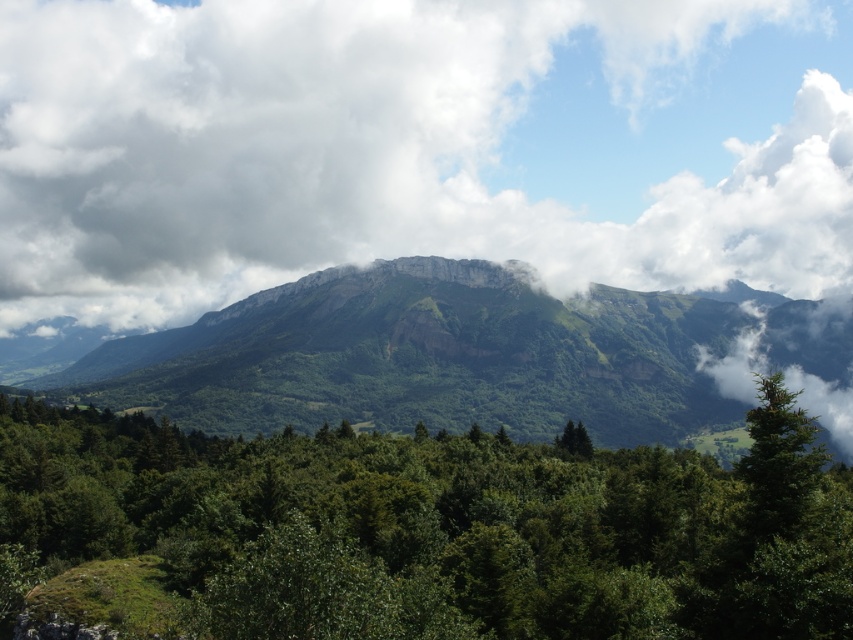
You are standing at the origin point in the image. Which direction should you walk to reach the green leafy tree at center?

The green leafy tree at center is located at coordinates approximately 0.827 on the x axis and 0.516 on the y axis. Since you are at the origin point, you should move towards the positive x and y directions to reach it.

You are an observer standing in the forest looking towards the mountains. You see the white fluffy cloud at upper center and the green matte tree at lower right. Which object is closer to you?

The white fluffy cloud at upper center is closer to you because it is further to the viewer than the green matte tree at lower right.